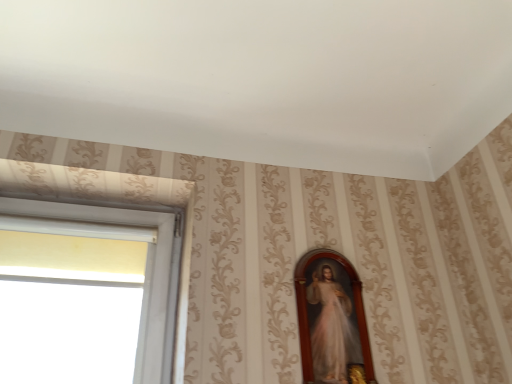
Question: Should I look upward or downward to see wooden frame at upper center?

Choices:
 (A) down
 (B) up

Answer: (A)